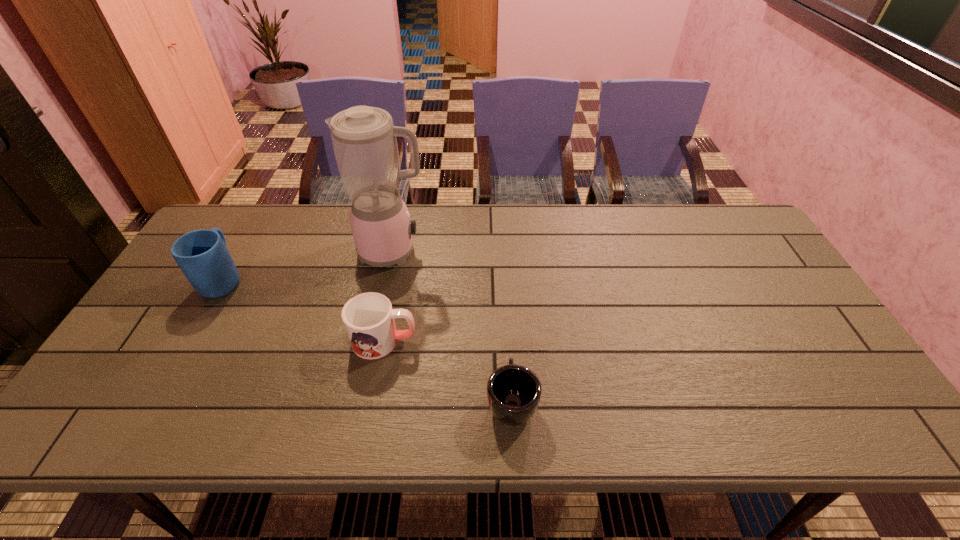
You are a GUI agent. You are given a task and a screenshot of the screen. Output one action in this format:
    pyautogui.click(x=<x>, y=<y>)
    Task: Click on the object that is the third closest to the shortest object
    
    Given the screenshot: What is the action you would take?
    pyautogui.click(x=202, y=255)

The height and width of the screenshot is (540, 960). In order to click on object that stands as the third closest to the second mug from right to left in this screenshot , I will do `click(202, 255)`.

Select which mug appears as the second closest to the tallest object. Please provide its 2D coordinates. Your answer should be formatted as a tuple, i.e. [(x, y)], where the tuple contains the x and y coordinates of a point satisfying the conditions above.

[(202, 255)]

The image size is (960, 540). What are the coordinates of `mug that stands as the second closest to the second farthest mug` in the screenshot? It's located at (202, 255).

Where is `vacant region that satisfies the following two spatial constraints: 1. on the base of the tallest object near the control knob; 2. on the side of the shortest object with the handle`? The height and width of the screenshot is (540, 960). vacant region that satisfies the following two spatial constraints: 1. on the base of the tallest object near the control knob; 2. on the side of the shortest object with the handle is located at coordinates click(x=362, y=401).

The height and width of the screenshot is (540, 960). In order to click on vacant space that satisfies the following two spatial constraints: 1. on the base of the tallest object near the control knob; 2. on the side of the shortest object with the handle in this screenshot , I will do `click(362, 401)`.

I want to click on free location that satisfies the following two spatial constraints: 1. on the side of the second tallest mug with the handle; 2. on the side of the nearest mug with the handle, so click(x=372, y=401).

Locate an element on the screen. vacant area that satisfies the following two spatial constraints: 1. on the side of the rightmost object with the handle; 2. on the base of the food processor near the control knob is located at coordinates (503, 252).

You are a GUI agent. You are given a task and a screenshot of the screen. Output one action in this format:
    pyautogui.click(x=<x>, y=<y>)
    Task: Click on the blank space that satisfies the following two spatial constraints: 1. on the side of the second farthest mug with the handle; 2. on the side of the shortest mug with the handle
    Image resolution: width=960 pixels, height=540 pixels.
    Given the screenshot: What is the action you would take?
    pyautogui.click(x=372, y=401)

Where is `free space that satisfies the following two spatial constraints: 1. on the side of the nearest mug with the handle; 2. on the side of the second nearest object with the handle`? The image size is (960, 540). free space that satisfies the following two spatial constraints: 1. on the side of the nearest mug with the handle; 2. on the side of the second nearest object with the handle is located at coordinates (508, 340).